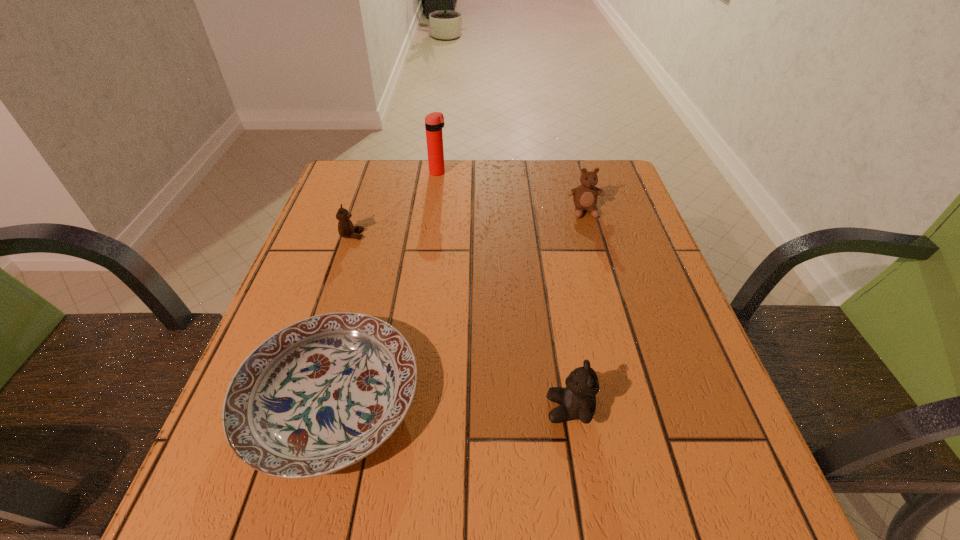
Identify the location of plate that is positioned at the left edge. The image size is (960, 540). (319, 395).

You are a GUI agent. You are given a task and a screenshot of the screen. Output one action in this format:
    pyautogui.click(x=<x>, y=<y>)
    Task: Click on the object present at the right edge
    
    Given the screenshot: What is the action you would take?
    pyautogui.click(x=585, y=196)

You are a GUI agent. You are given a task and a screenshot of the screen. Output one action in this format:
    pyautogui.click(x=<x>, y=<y>)
    Task: Click on the object at the near left corner
    The width and height of the screenshot is (960, 540).
    Given the screenshot: What is the action you would take?
    pyautogui.click(x=319, y=395)

Image resolution: width=960 pixels, height=540 pixels. In order to click on object present at the far right corner in this screenshot , I will do `click(585, 196)`.

Image resolution: width=960 pixels, height=540 pixels. In order to click on free space at the far edge of the desktop in this screenshot , I will do 451,185.

In the image, there is a desktop. Where is `vacant space at the near edge`? The image size is (960, 540). vacant space at the near edge is located at coordinates (629, 484).

You are a GUI agent. You are given a task and a screenshot of the screen. Output one action in this format:
    pyautogui.click(x=<x>, y=<y>)
    Task: Click on the vacant space at the left edge of the desktop
    The height and width of the screenshot is (540, 960).
    Given the screenshot: What is the action you would take?
    pyautogui.click(x=325, y=276)

The height and width of the screenshot is (540, 960). I want to click on blank area at the right edge, so click(x=629, y=310).

In the image, there is a desktop. Where is `vacant space at the far left corner`? This screenshot has width=960, height=540. vacant space at the far left corner is located at coordinates (368, 180).

In the image, there is a desktop. Identify the location of vacant region at the near left corner. (303, 487).